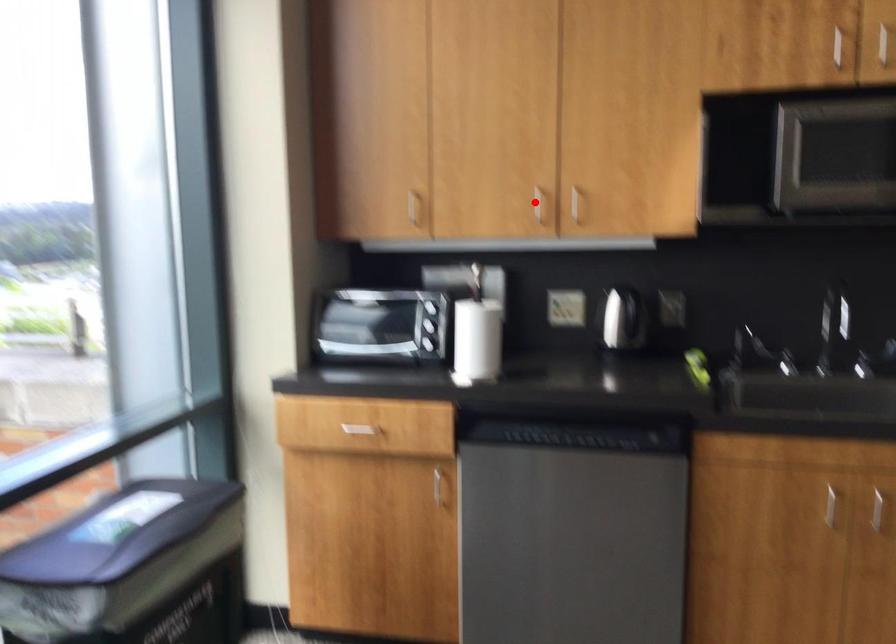
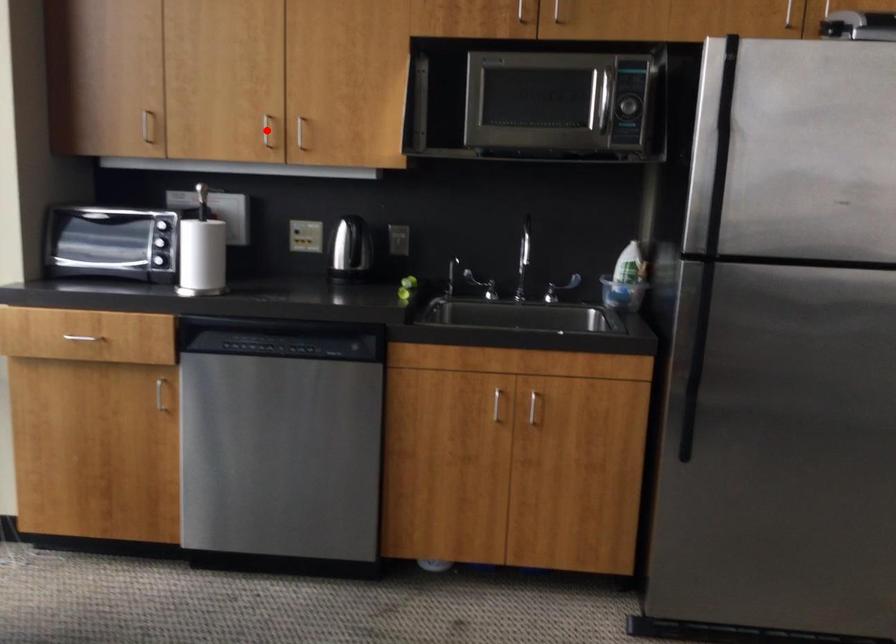
I am providing you with two images of the same scene from different viewpoints. A red point is marked on the first image and another point is marked on the second image. Does the point marked in image1 correspond to the same location as the one in image2?

Yes